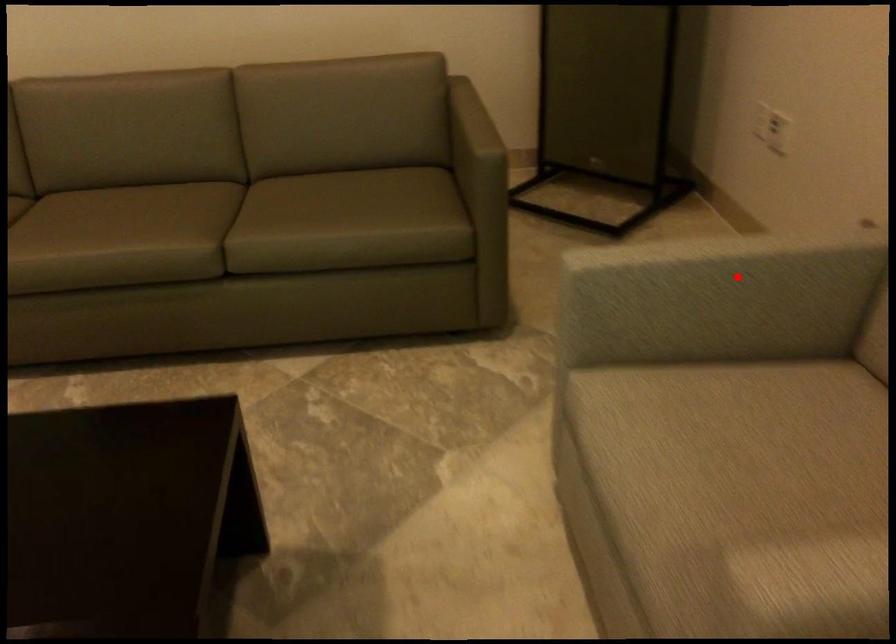
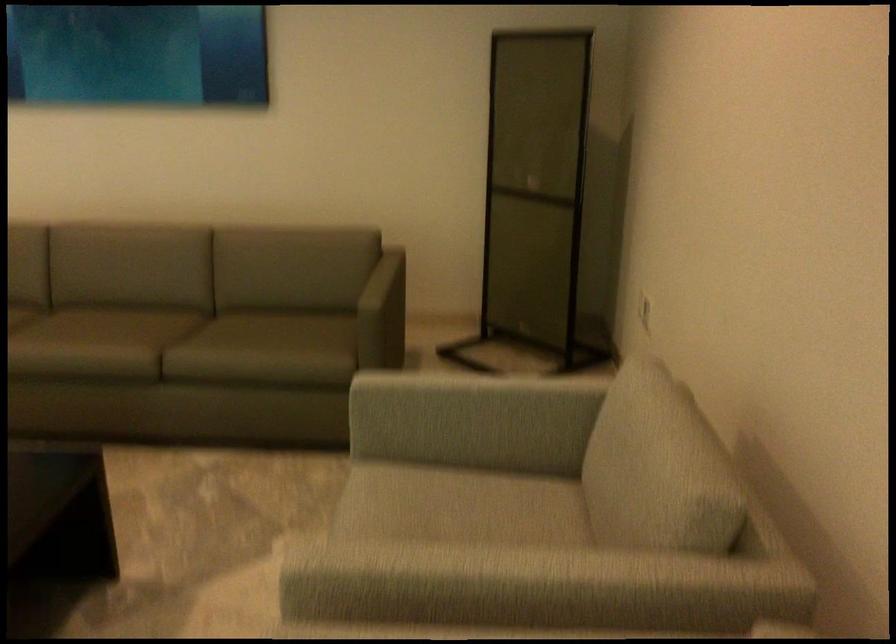
The point at the highlighted location is marked in the first image. Where is the corresponding point in the second image?

(469, 399)